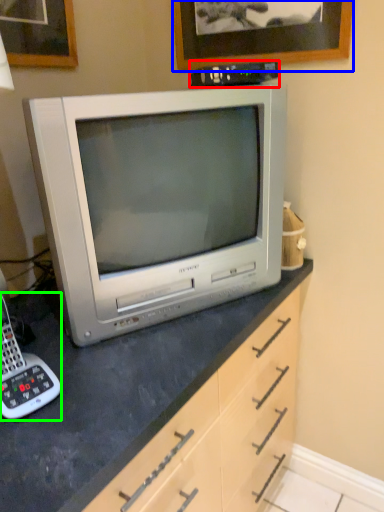
Question: Considering the real-world distances, which object is closest to appliance (highlighted by a red box)? picture frame (highlighted by a blue box) or corded phone (highlighted by a green box).

Choices:
 (A) picture frame
 (B) corded phone

Answer: (A)